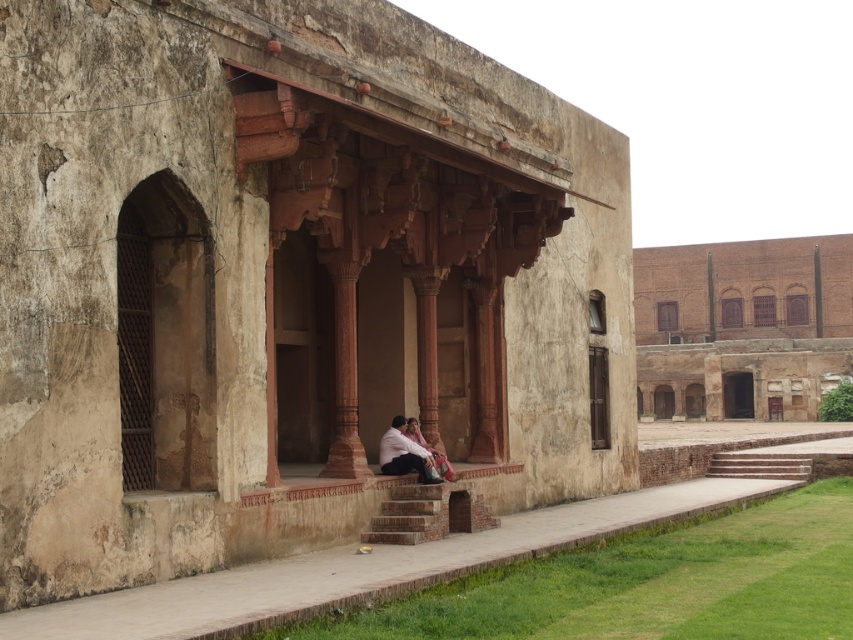
Does brown stone palace at center have a smaller size compared to brown stone stairs at center?

No, brown stone palace at center is not smaller than brown stone stairs at center.

Between point (163, 8) and point (428, 538), which one is positioned behind?

Positioned behind is point (428, 538).

Image resolution: width=853 pixels, height=640 pixels. Identify the location of brown stone palace at center. (286, 280).

What do you see at coordinates (286, 280) in the screenshot? The width and height of the screenshot is (853, 640). I see `brown stone palace at center` at bounding box center [286, 280].

Who is lower down, brown stone palace at center or matte pink fabric at center?

matte pink fabric at center is below.

Who is more distant from viewer, (x=10, y=77) or (x=433, y=468)?

The point (x=433, y=468) is more distant.

Locate an element on the screen. The image size is (853, 640). brown stone palace at center is located at coordinates (286, 280).

The width and height of the screenshot is (853, 640). What do you see at coordinates (286, 280) in the screenshot?
I see `brown stone palace at center` at bounding box center [286, 280].

Between point (387, 172) and point (741, 244), which one is positioned in front?

Point (387, 172)

Is point (258, 364) closer to viewer compared to point (668, 248)?

Yes, it is.

Locate an element on the screen. brown stone palace at center is located at coordinates (286, 280).